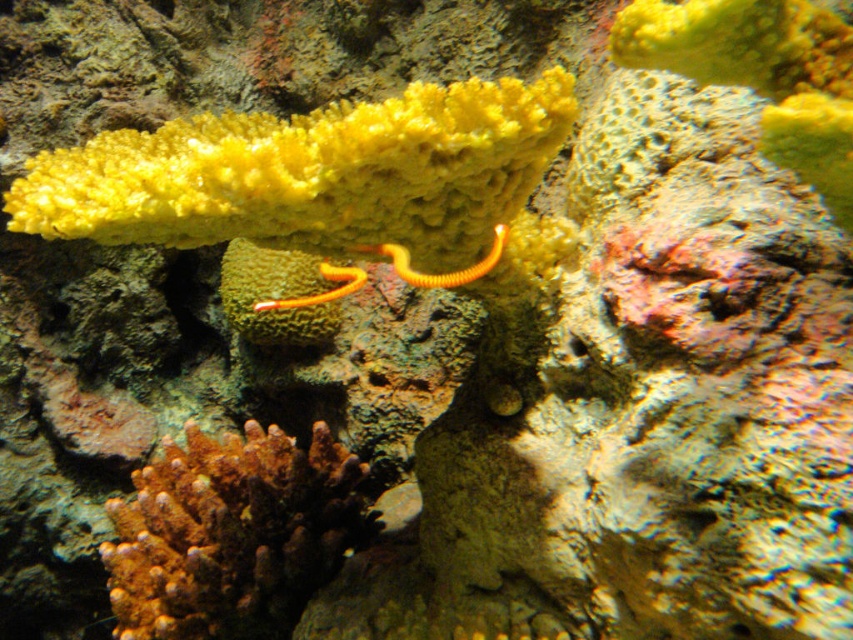
In the scene shown: You are a marine biologist observing the underwater scene. You notice the orange coral at center and the yellow rubber worm at center. Which of these two objects is positioned higher in the image?

The yellow rubber worm at center is positioned higher than the orange coral at center.